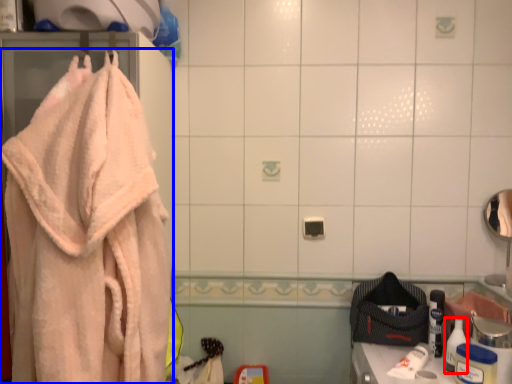
Question: Which object appears farthest to the camera in this image, toiletry (highlighted by a red box) or towel (highlighted by a blue box)?

Choices:
 (A) toiletry
 (B) towel

Answer: (A)